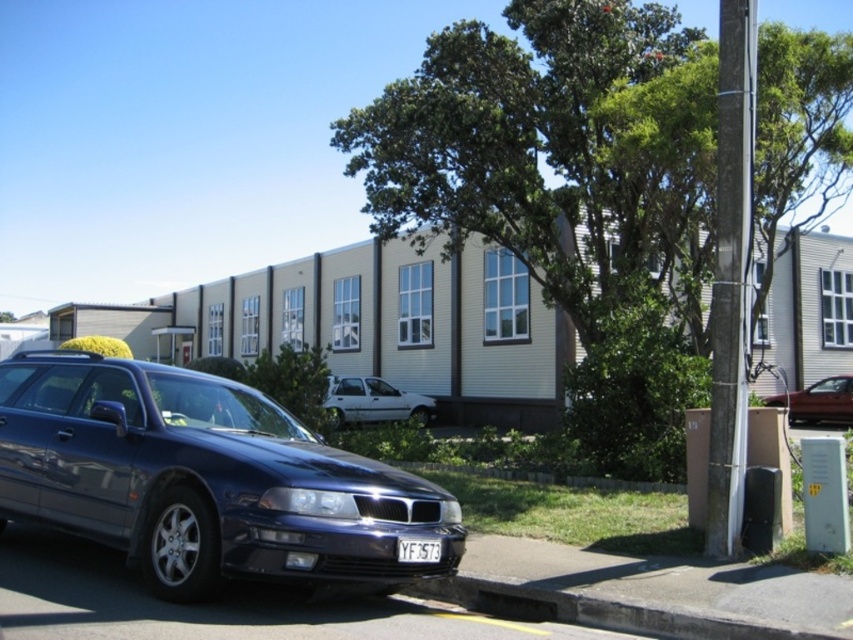
You are standing in front of the modern building and looking at the two points marked on the image. Which point, point [616,419] or point [817,401], is closer to you?

Point [616,419] is closer to the camera than point [817,401].

You are standing on the sidewalk in front of the modern building and want to take a photo of both the green leafy tree at center and the shiny red car at right. Which object should you focus on first to ensure both are in the frame?

You should focus on the green leafy tree at center first because it is closer to you than the shiny red car at right, so adjusting the camera to include it will naturally include the car in the background as well.